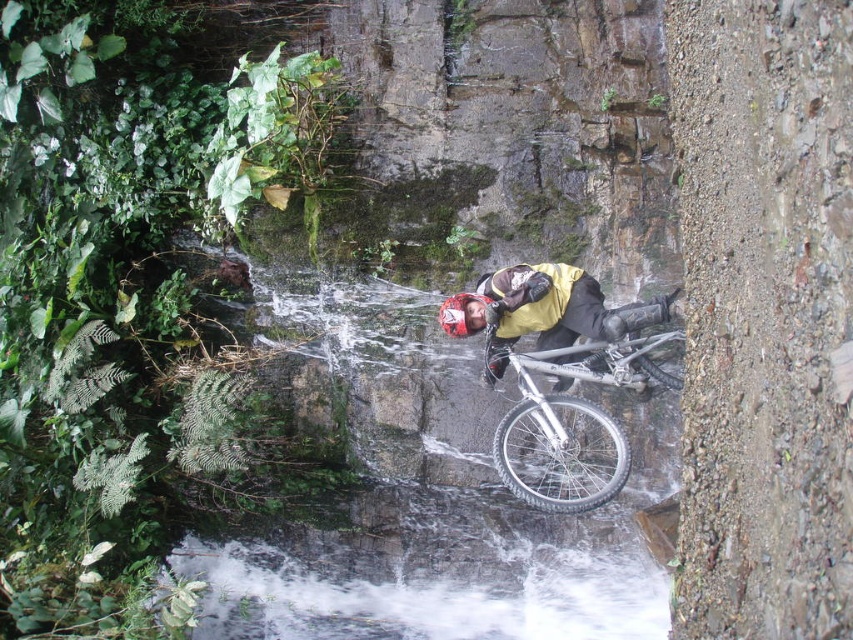
You are a photographer trying to capture the rider and their bike in the waterway. Since the silver metallic mountain bike at center and the yellow matte jacket at center are both at the center, which one should you focus on to ensure the other is also in the frame?

The silver metallic mountain bike at center is in front of the yellow matte jacket at center. To ensure both are in the frame, focus on the yellow matte jacket at center since it is behind the bike, allowing the bike to naturally stay in the shot as well.

You are a hiker planning to cross the rocky waterway shown in the image. You see the silver metallic mountain bike at center and the yellow matte jacket at center. Which object is wider? Please answer based on their widths.

The yellow matte jacket at center is wider than the silver metallic mountain bike at center.